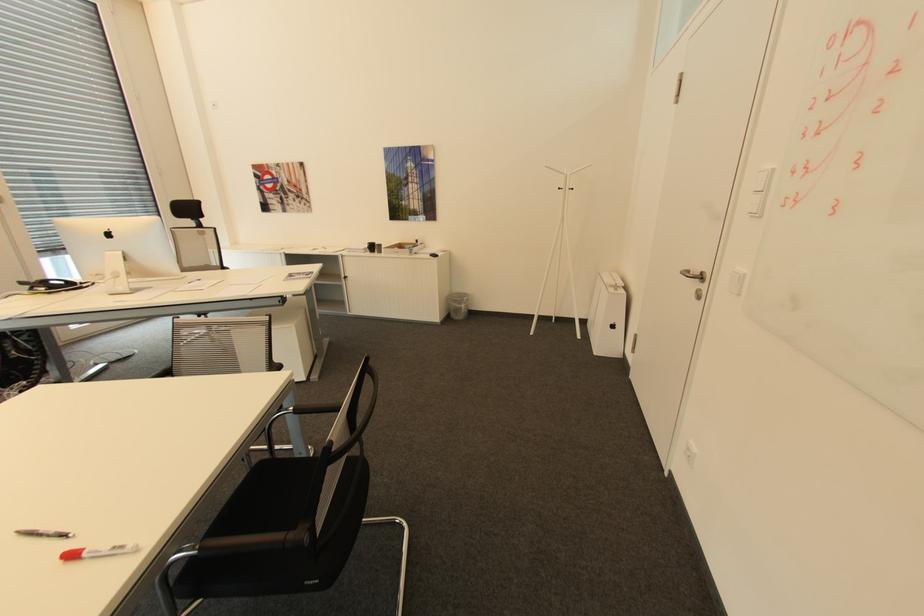
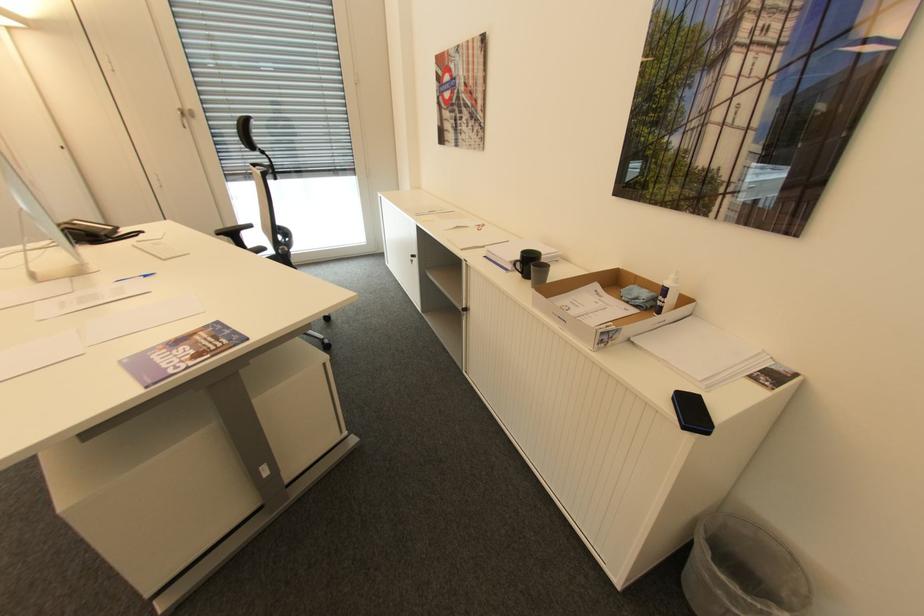
Locate, in the second image, the point that corresponds to point 369,248 in the first image.

(516, 262)